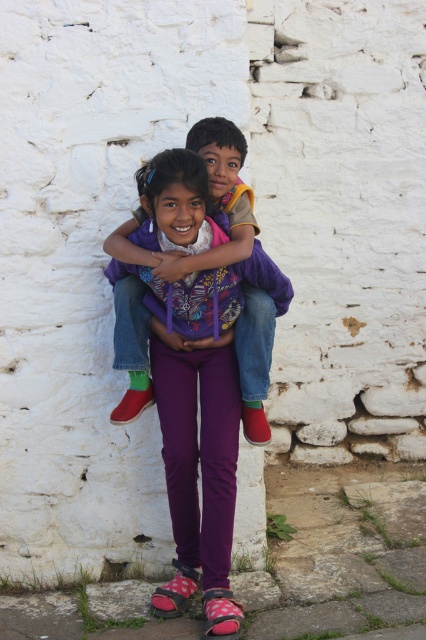
You are a photographer trying to capture a clear shot of both the purple fleece jacket at center and the purple fabric at center. Which one should you focus on first to ensure it appears sharp in the photo?

The purple fleece jacket at center is closer to the viewer than the purple fabric at center, so you should focus on the purple fleece jacket at center first to ensure it appears sharp.

You are a photographer trying to capture a photo of the two children. You notice the purple fleece jacket at center and the purple fabric at center in the scene. Which one is taller?

The purple fleece jacket at center is taller than the purple fabric at center.

You are a photographer trying to capture a photo of the purple fleece jacket at center. You have a camera with a 100mm lens that has a field of view of 15 degrees. The point representing the jacket is at coordinates point (219, 195). If the camera is positioned such that the center of the frame is at point 0.5, 0.5, will the jacket be fully within the field of view?

The purple fleece jacket at center is represented by point (219, 195). Since the camera is centered at 0.5, 0.5, the distance between the center and the jacket is sqrt of the squared differences in x and y coordinates. The field of view is 15 degrees, so the maximum distance from the center that can be captured is half the field of view. Calculating the angle between the two points, if it is less than 7.5 degrees, the jacket will be within the field of view. However, without exact distance from the camera